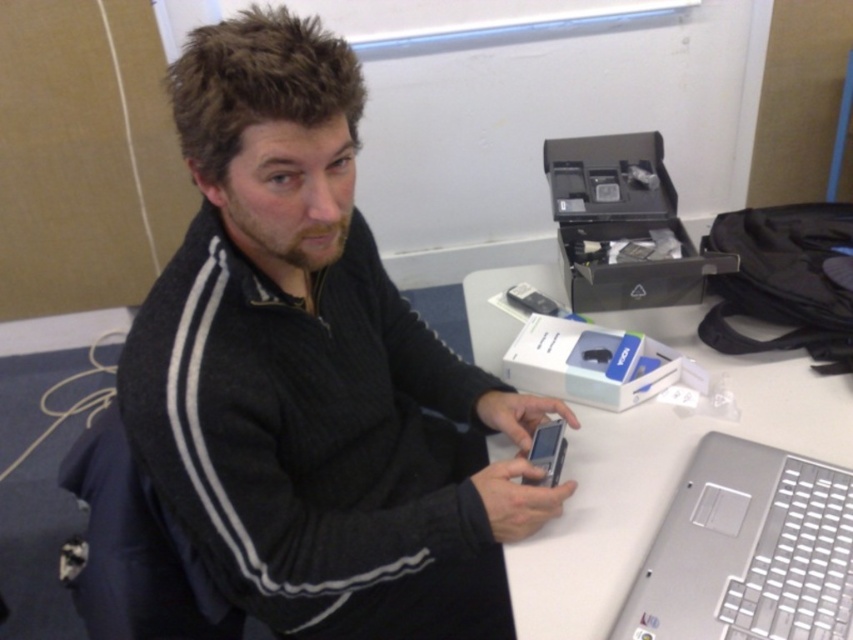
Does silver metallic table at center appear over satin silver phone at center?

Indeed, silver metallic table at center is positioned over satin silver phone at center.

Locate an element on the screen. This screenshot has height=640, width=853. silver metallic table at center is located at coordinates (656, 480).

The height and width of the screenshot is (640, 853). In order to click on silver metallic table at center in this screenshot , I will do `click(656, 480)`.

Who is shorter, silver metallic laptop at lower right or satin silver phone at center?

satin silver phone at center is shorter.

Does silver metallic laptop at lower right have a smaller size compared to satin silver phone at center?

Actually, silver metallic laptop at lower right might be larger than satin silver phone at center.

Identify the location of silver metallic laptop at lower right. (747, 550).

Image resolution: width=853 pixels, height=640 pixels. What are the coordinates of `silver metallic laptop at lower right` in the screenshot? It's located at (747, 550).

Can you confirm if silver metallic table at center is thinner than silver metallic laptop at lower right?

In fact, silver metallic table at center might be wider than silver metallic laptop at lower right.

Is silver metallic table at center smaller than silver metallic laptop at lower right?

No.

Which is behind, point (744, 397) or point (686, 561)?

Positioned behind is point (744, 397).

The image size is (853, 640). In order to click on silver metallic table at center in this screenshot , I will do [x=656, y=480].